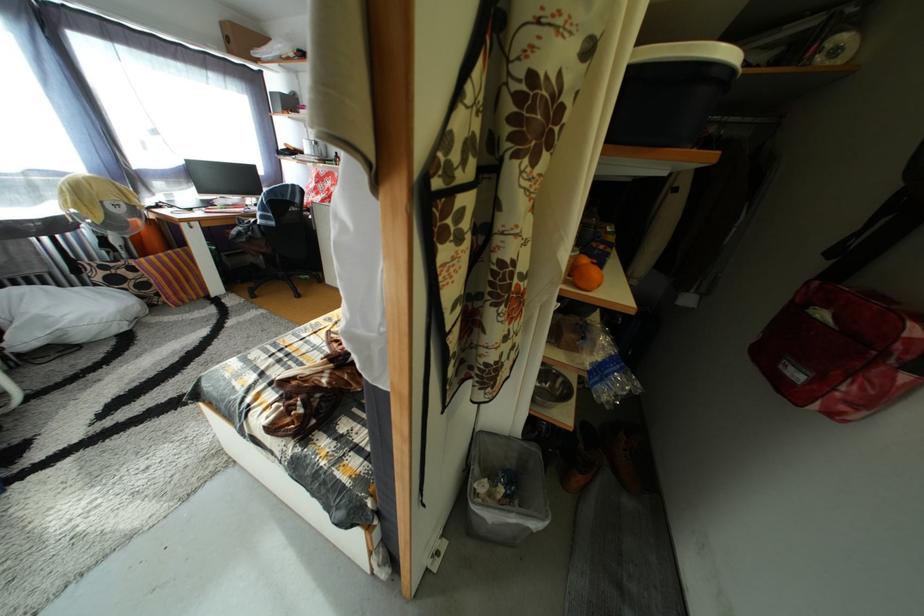
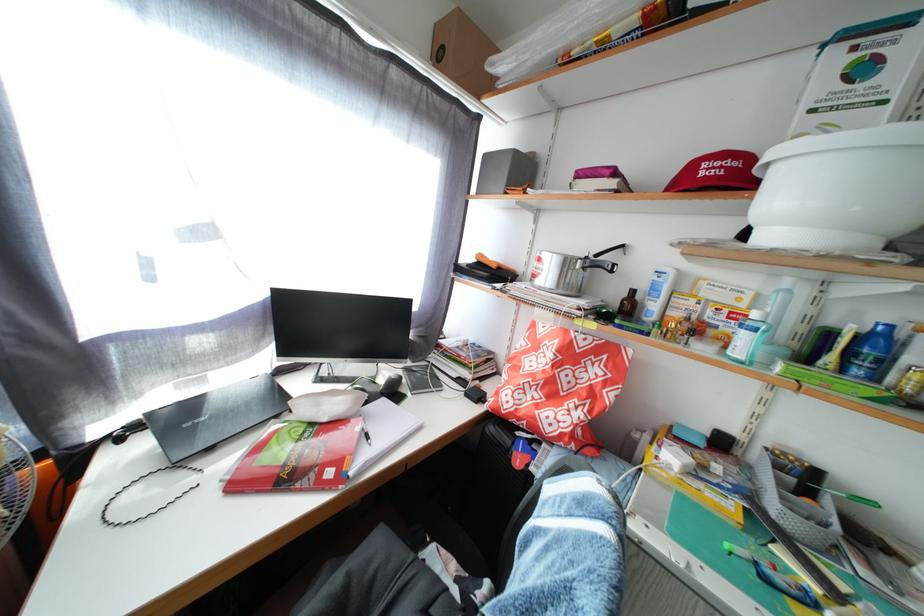
Find the pixel in the second image that matches pixel 295 151 in the first image.

(489, 262)